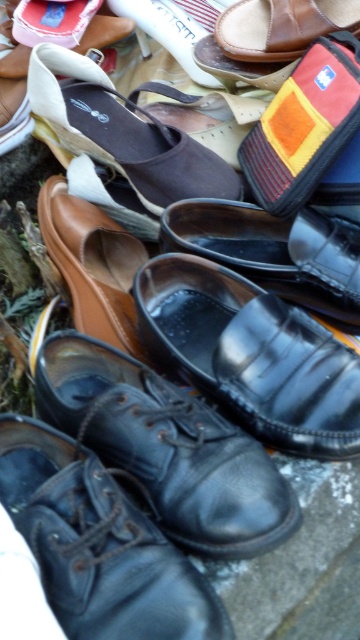
Who is positioned more to the right, black leather dress shoe at lower left or brown fabric sandal at upper center?

Answer: brown fabric sandal at upper center is more to the right.

Is point (164, 547) behind point (156, 196)?

No, it is not.

Where is `black leather dress shoe at lower left`? black leather dress shoe at lower left is located at coordinates (99, 545).

Can you confirm if black leather shoes at center is wider than brown fabric sandal at upper center?

No.

Is black leather shoes at center above brown fabric sandal at upper center?

Actually, black leather shoes at center is below brown fabric sandal at upper center.

Locate an element on the screen. The image size is (360, 640). black leather shoes at center is located at coordinates (250, 355).

Which of these two, black leather dress shoe at lower left or black leather shoes at center, stands shorter?

black leather dress shoe at lower left is shorter.

Which is in front, point (60, 470) or point (272, 435)?

Positioned in front is point (60, 470).

The image size is (360, 640). Identify the location of black leather dress shoe at lower left. (99, 545).